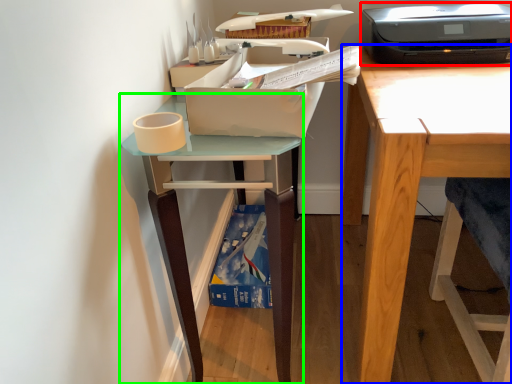
Question: Estimate the real-world distances between objects in this image. Which object is closer to printer (highlighted by a red box), desk (highlighted by a blue box) or table (highlighted by a green box)?

Choices:
 (A) desk
 (B) table

Answer: (A)